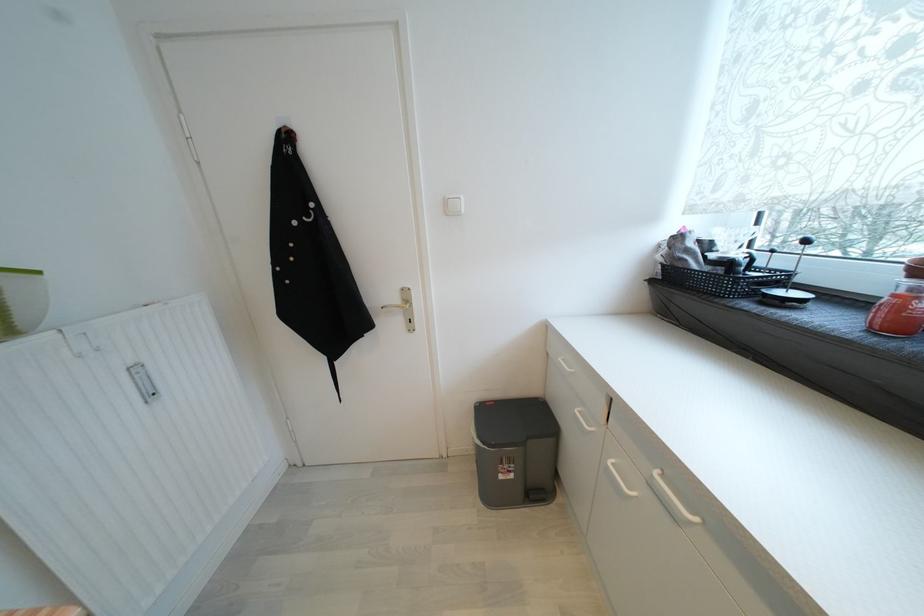
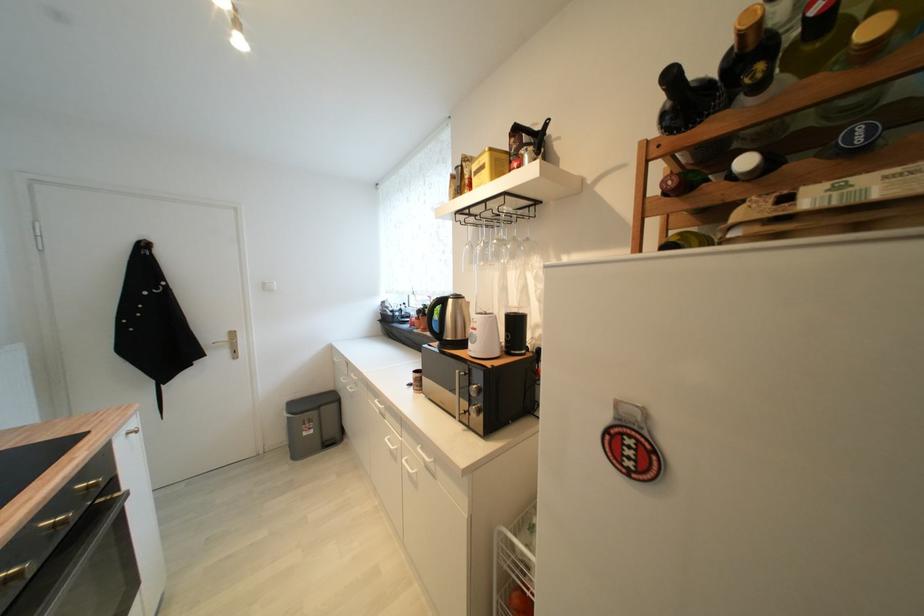
The point at (x=453, y=209) is marked in the first image. Where is the corresponding point in the second image?

(271, 289)